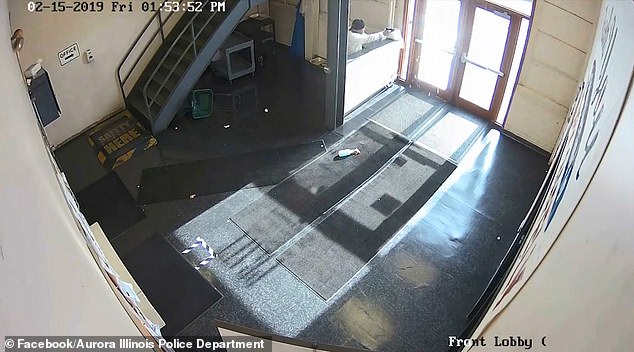
Locate an element on the screen. The width and height of the screenshot is (634, 352). stair is located at coordinates (178, 65).